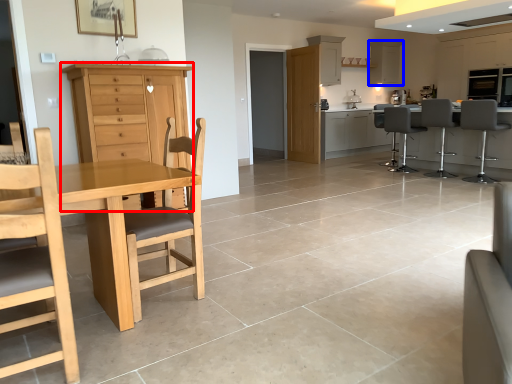
Question: Among these objects, which one is farthest to the camera, cabinetry (highlighted by a red box) or cabinetry (highlighted by a blue box)?

Choices:
 (A) cabinetry
 (B) cabinetry

Answer: (B)